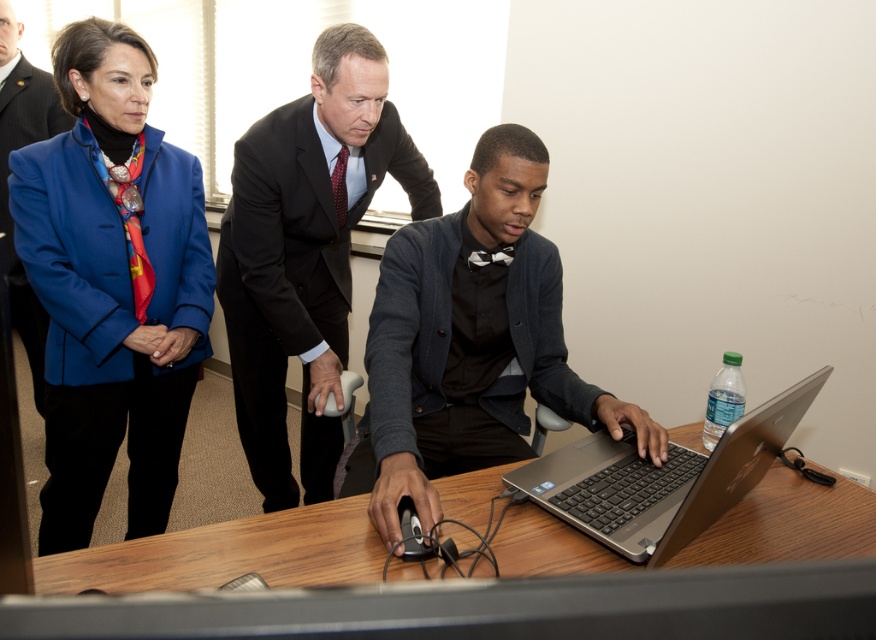
You are planning to place a rectangular object on the wooden table at center. The object is exactly the same width as the silver metallic laptop at center. Will this object fit entirely on the table without overhanging?

Yes, the object will fit entirely on the wooden table at center because the wooden table at center is wider than the silver metallic laptop at center.

You are organizing a meeting in a room with limited space. You have to place the wooden table at center and the matte blue blazer at upper left. Considering their sizes, which object should be placed closer to the wall to save space?

The wooden table at center is smaller than the matte blue blazer at upper left, so the wooden table at center should be placed closer to the wall to save space.